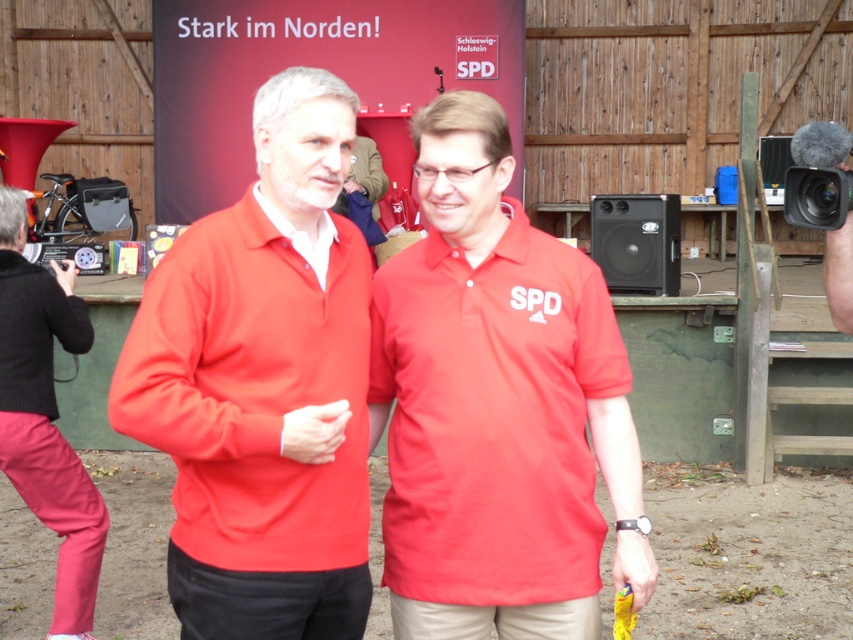
Question: Which of the following is the farthest from the observer?

Choices:
 (A) matte red polo shirt at center
 (B) black plastic video camera at upper right
 (C) pink cotton pants at lower left
 (D) matte red sweater at center

Answer: (C)

Question: Does matte red sweater at center have a greater width compared to black plastic video camera at upper right?

Choices:
 (A) no
 (B) yes

Answer: (B)

Question: Can you confirm if matte red polo shirt at center is positioned below black plastic video camera at upper right?

Choices:
 (A) no
 (B) yes

Answer: (B)

Question: Does matte red polo shirt at center lie in front of pink cotton pants at lower left?

Choices:
 (A) no
 (B) yes

Answer: (B)

Question: Estimate the real-world distances between objects in this image. Which object is closer to the matte red polo shirt at center?

Choices:
 (A) matte red sweater at center
 (B) black plastic video camera at upper right

Answer: (A)

Question: Among these points, which one is farthest from the camera?

Choices:
 (A) (419, 525)
 (B) (836, 192)
 (C) (51, 296)
 (D) (254, 584)

Answer: (C)